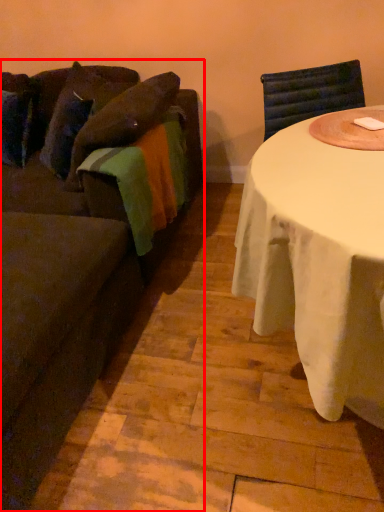
Question: Observing the image, what is the correct spatial positioning of studio couch (annotated by the red box) in reference to pillow?

Choices:
 (A) left
 (B) right

Answer: (A)